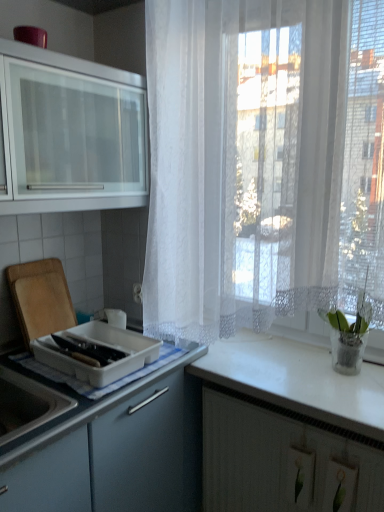
Question: Can you confirm if matte glass cabinet at upper left, marked as the second cabinetry in a right-to-left arrangement, is positioned to the right of white glossy countertop at right?

Choices:
 (A) no
 (B) yes

Answer: (A)

Question: Is matte glass cabinet at upper left, the first cabinetry when ordered from top to bottom, shorter than white glossy countertop at right?

Choices:
 (A) no
 (B) yes

Answer: (A)

Question: From a real-world perspective, is matte glass cabinet at upper left, the first cabinetry when ordered from top to bottom, physically above white glossy countertop at right?

Choices:
 (A) no
 (B) yes

Answer: (B)

Question: Is matte glass cabinet at upper left, the first cabinetry when ordered from top to bottom, looking in the opposite direction of white glossy countertop at right?

Choices:
 (A) yes
 (B) no

Answer: (B)

Question: Considering the relative sizes of matte glass cabinet at upper left, placed as the 1th cabinetry when sorted from left to right, and white glossy countertop at right in the image provided, is matte glass cabinet at upper left, placed as the 1th cabinetry when sorted from left to right, bigger than white glossy countertop at right?

Choices:
 (A) no
 (B) yes

Answer: (B)

Question: Is matte glass cabinet at upper left, the 2th cabinetry positioned from the bottom, facing towards white glossy countertop at right?

Choices:
 (A) yes
 (B) no

Answer: (B)

Question: From a real-world perspective, does white plastic container at left sit lower than white glossy countertop at right?

Choices:
 (A) yes
 (B) no

Answer: (B)

Question: Can you confirm if white plastic container at left is taller than white glossy countertop at right?

Choices:
 (A) no
 (B) yes

Answer: (B)

Question: Could you tell me if white plastic container at left is facing white glossy countertop at right?

Choices:
 (A) yes
 (B) no

Answer: (B)

Question: Is white plastic container at left positioned in front of white glossy countertop at right?

Choices:
 (A) yes
 (B) no

Answer: (B)

Question: Is white glossy countertop at right a part of white plastic container at left?

Choices:
 (A) yes
 (B) no

Answer: (B)

Question: Is white plastic container at left facing away from white glossy countertop at right?

Choices:
 (A) no
 (B) yes

Answer: (A)

Question: Can you confirm if white matte cabinet at lower right, which is the 1th cabinetry in bottom-to-top order, is positioned to the right of green glass vase at right?

Choices:
 (A) no
 (B) yes

Answer: (A)